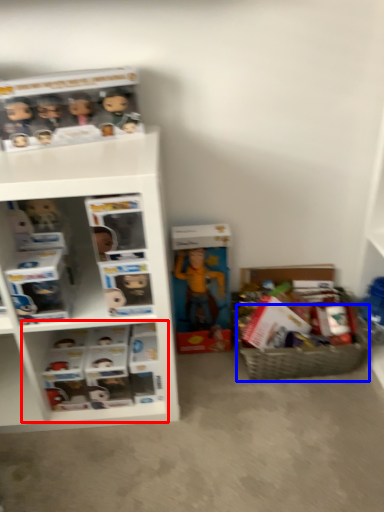
Question: Which of the following is the farthest to the observer, cabinet (highlighted by a red box) or basket (highlighted by a blue box)?

Choices:
 (A) cabinet
 (B) basket

Answer: (B)